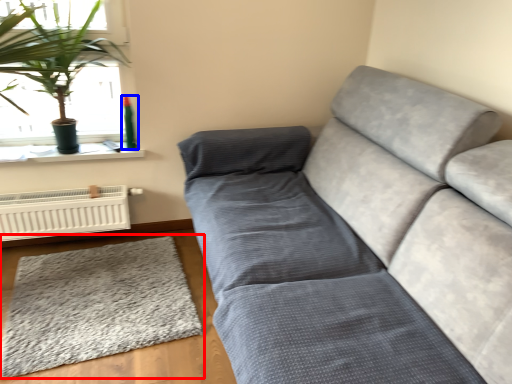
Question: Which object appears closest to the camera in this image, mat (highlighted by a red box) or teal (highlighted by a blue box)?

Choices:
 (A) mat
 (B) teal

Answer: (A)